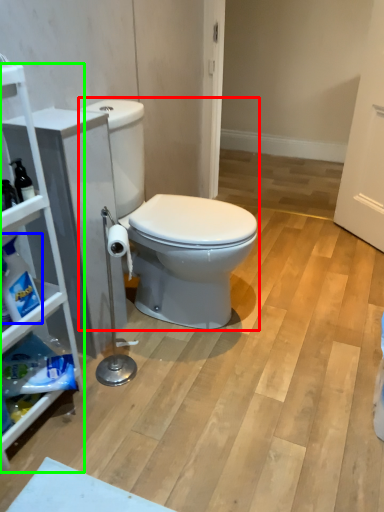
Question: Based on their relative distances, which object is farther from toilet (highlighted by a red box)? Choose from cleaning product (highlighted by a blue box) and cabinetry (highlighted by a green box).

Choices:
 (A) cleaning product
 (B) cabinetry

Answer: (A)